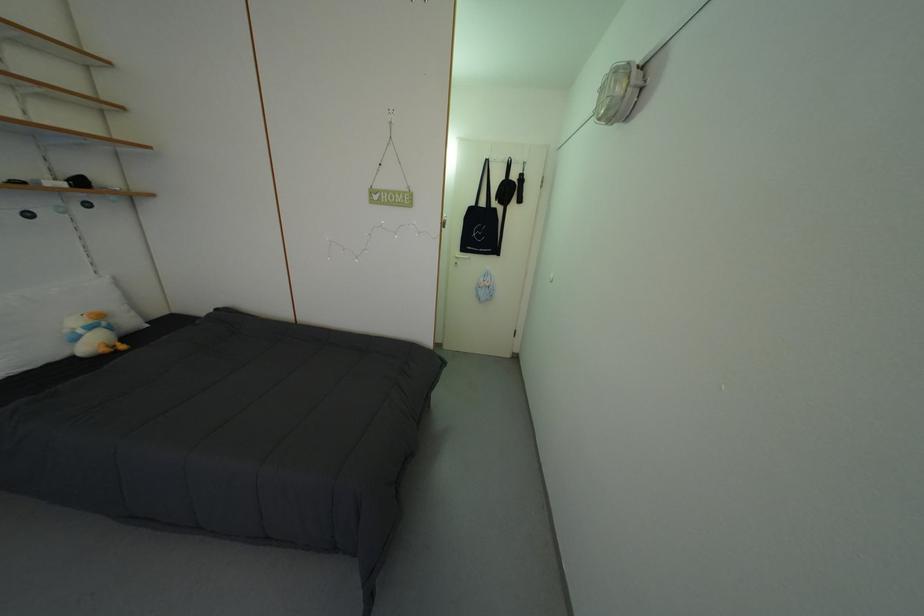
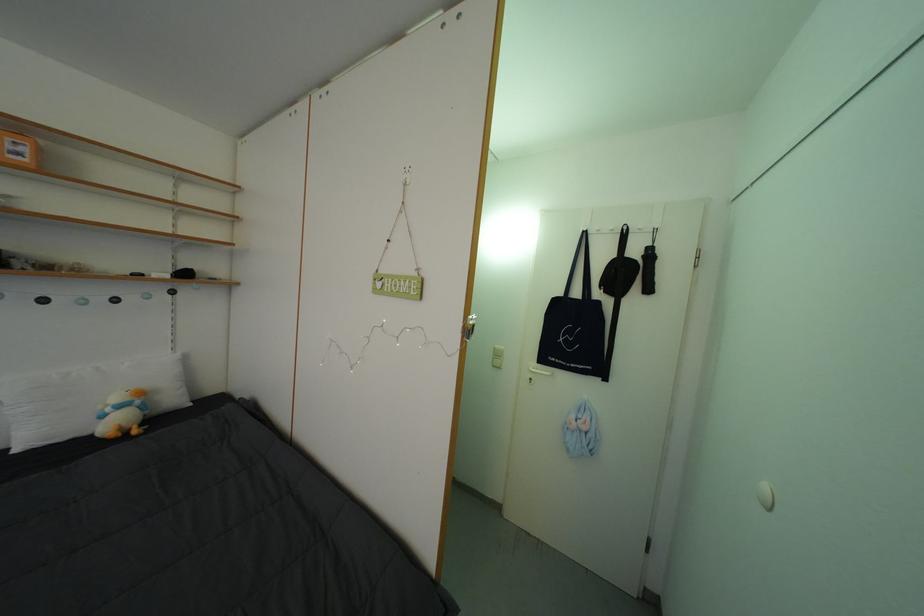
Locate, in the second image, the point that corresponds to (x=505, y=185) in the first image.

(611, 264)